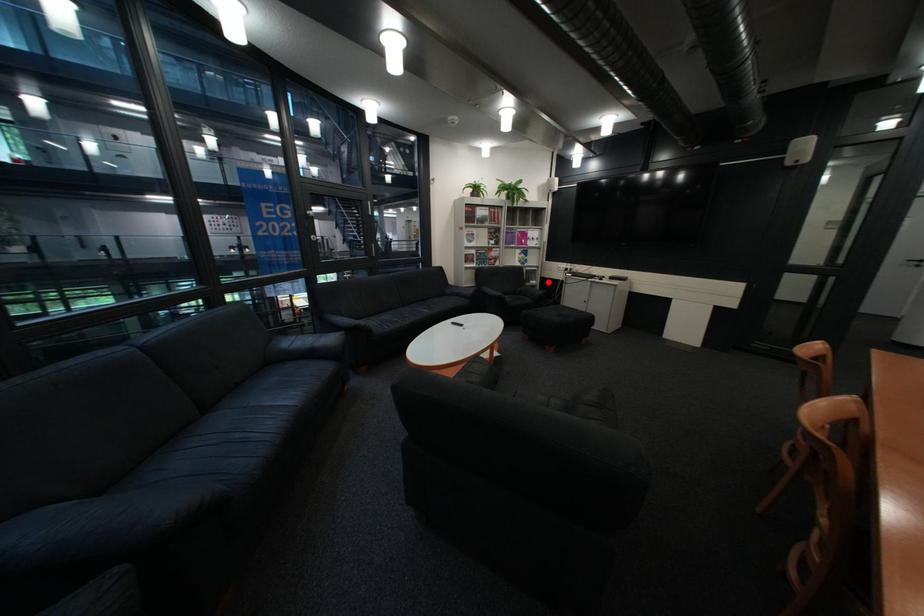
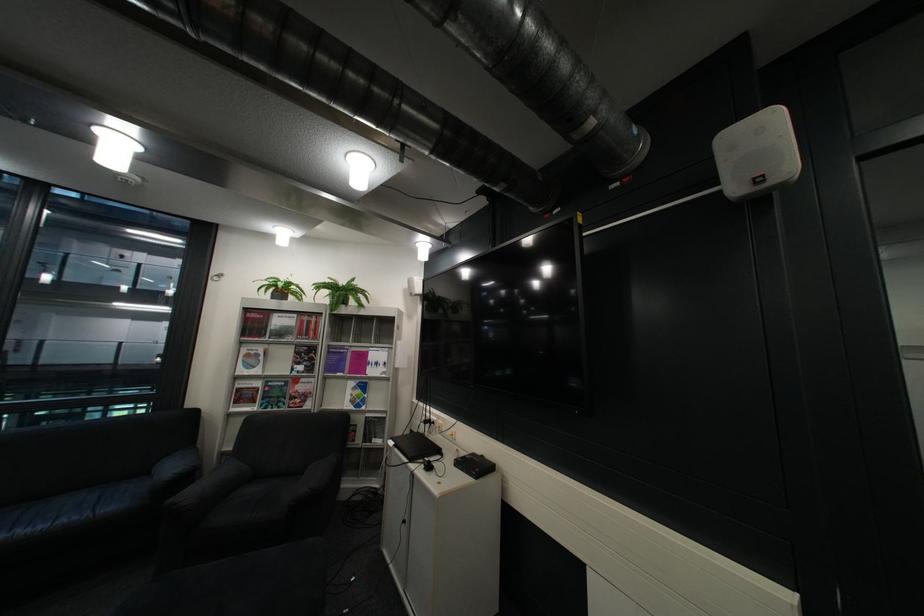
Question: A red point is marked in image1. In image2, is the corresponding 3D point closer to the camera or farther? Reply with the corresponding letter.

Choices:
 (A) The corresponding 3D point is closer.
 (B) The corresponding 3D point is farther.

Answer: (B)